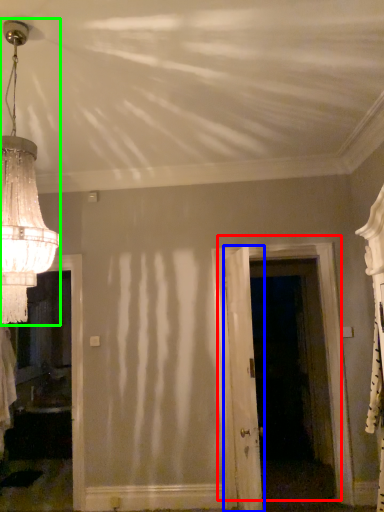
Question: Which is nearer to the door (highlighted by a red box)? door (highlighted by a blue box) or lamp (highlighted by a green box).

Choices:
 (A) door
 (B) lamp

Answer: (A)